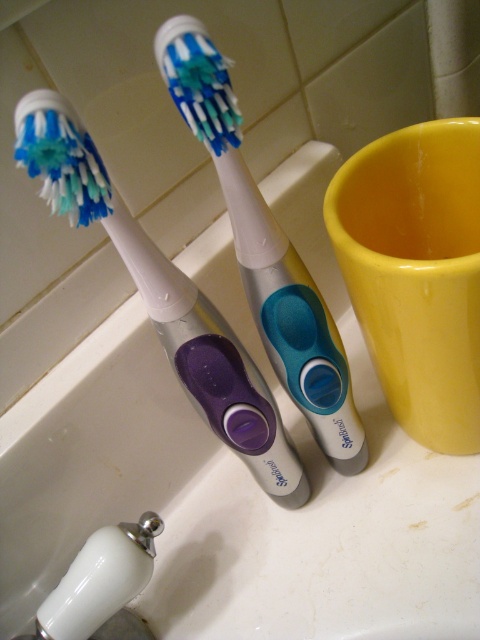
Can you confirm if purple plastic toothbrush at left is positioned to the right of silver/plastic toothbrush at center?

No, purple plastic toothbrush at left is not to the right of silver/plastic toothbrush at center.

Does point (47, 173) lie in front of point (284, 252)?

Yes, point (47, 173) is closer to viewer.

At what (x,y) coordinates should I click in order to perform the action: click on purple plastic toothbrush at left. Please return your answer as a coordinate pair (x, y). Looking at the image, I should click on (164, 298).

Can you confirm if yellow glossy mug at right is bigger than purple plastic toothbrush at left?

No, yellow glossy mug at right is not bigger than purple plastic toothbrush at left.

Between yellow glossy mug at right and purple plastic toothbrush at left, which one is positioned lower?

purple plastic toothbrush at left is below.

What do you see at coordinates (417, 273) in the screenshot? The width and height of the screenshot is (480, 640). I see `yellow glossy mug at right` at bounding box center [417, 273].

Image resolution: width=480 pixels, height=640 pixels. I want to click on yellow glossy mug at right, so click(x=417, y=273).

Can you confirm if yellow glossy mug at right is positioned to the right of silver/plastic toothbrush at center?

Answer: Yes, yellow glossy mug at right is to the right of silver/plastic toothbrush at center.

Who is lower down, yellow glossy mug at right or silver/plastic toothbrush at center?

yellow glossy mug at right

The width and height of the screenshot is (480, 640). In order to click on yellow glossy mug at right in this screenshot , I will do `click(417, 273)`.

At what (x,y) coordinates should I click in order to perform the action: click on yellow glossy mug at right. Please return your answer as a coordinate pair (x, y). Looking at the image, I should click on (417, 273).